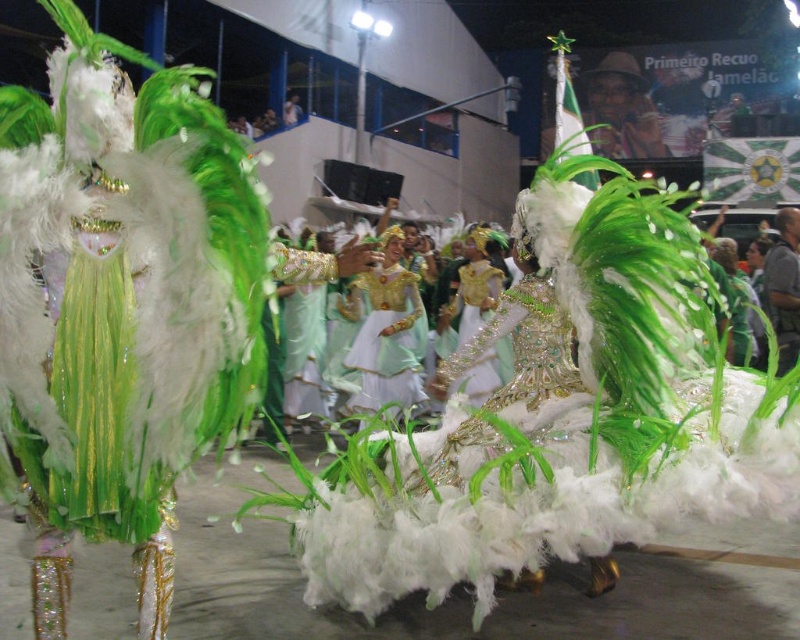
You are a photographer at the carnival. You want to capture a photo where both the green feathered costume at center and the shiny gold dress at center are visible. Which costume should you focus on to ensure the other is also in frame?

The green feathered costume at center is smaller in size compared to the shiny gold dress at center. To ensure both are visible, focus on the shiny gold dress at center since it is larger and easier to frame while the smaller green feathered costume at center will also fit into the shot.

You are a photographer at the carnival and want to take a photo focusing on both the green feathered costume at center and the shiny gold dress at center. Since you can only focus on one subject clearly, which one should you choose to ensure the other remains somewhat in focus?

The green feathered costume at center is closer to the viewer than the shiny gold dress at center, so focusing on the shiny gold dress at center will keep the green feathered costume at center in better focus in the background.

You are a photographer positioned at the center of the image. You want to capture a closeup shot of the matte green dress at center. Based on its position, which direction should you aim your camera?

The matte green dress at center is located at point coordinates 0.522 on the x axis and 0.484 on the y axis, which is very close to the center of the image. Therefore, you should aim your camera directly towards the center of the image to capture the matte green dress at center.